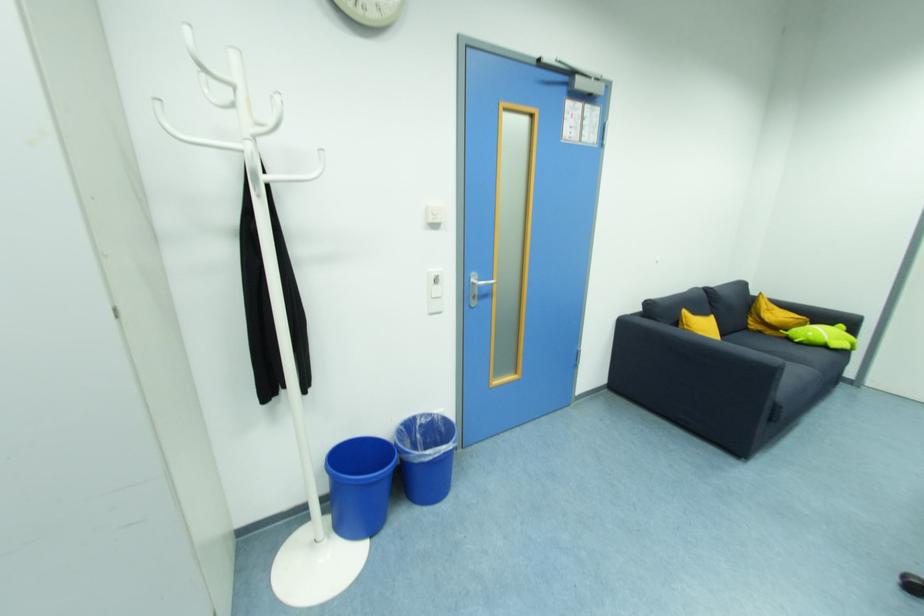
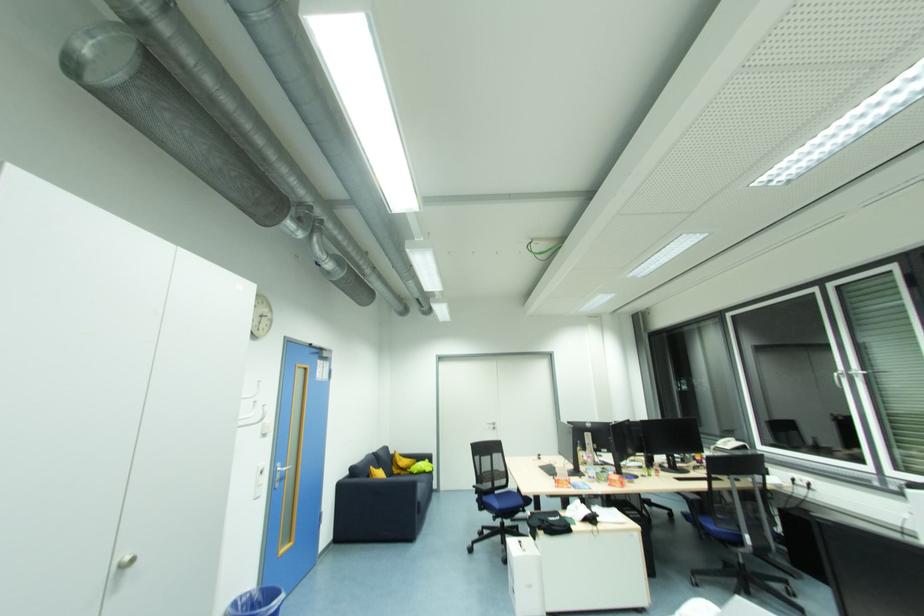
The point at (433, 459) is marked in the first image. Where is the corresponding point in the second image?

(280, 607)